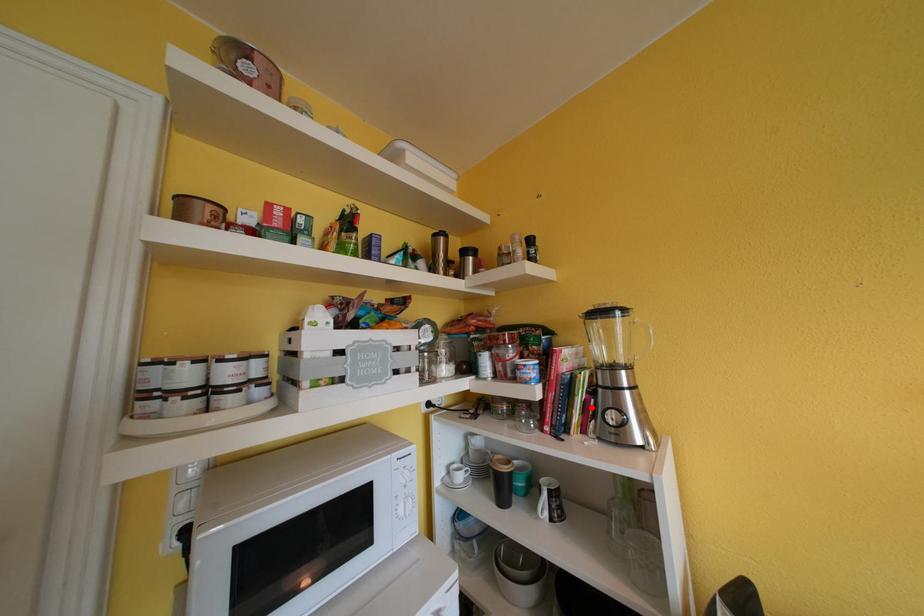
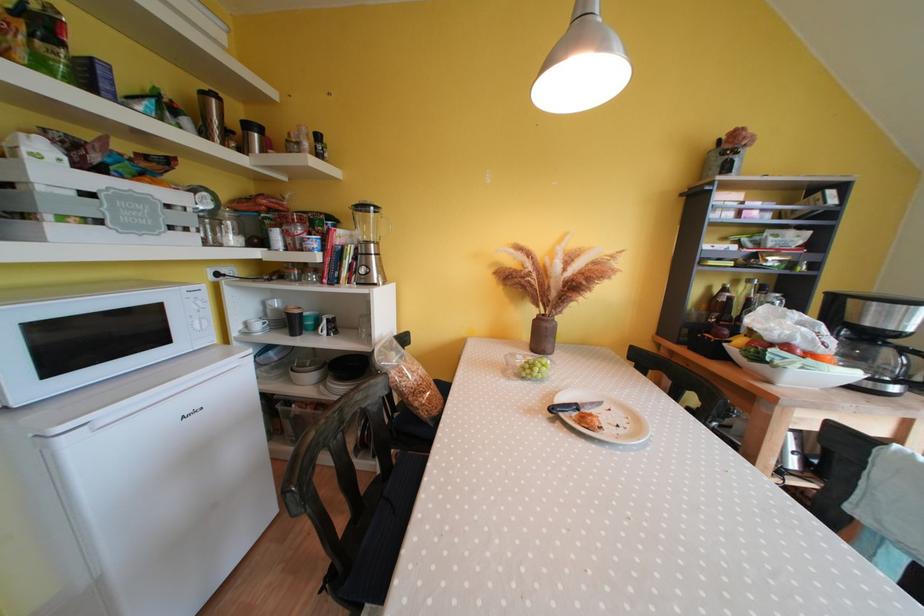
Locate, in the second image, the point that corresponds to the highlighted location in the first image.

(357, 269)